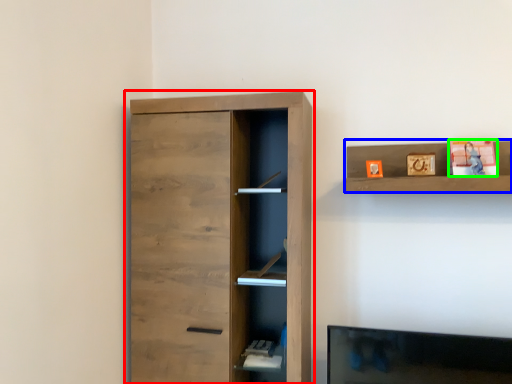
Question: Which object is the closest to the cupboard (highlighted by a red box)? Choose among these: shelf (highlighted by a blue box) or toy (highlighted by a green box).

Choices:
 (A) shelf
 (B) toy

Answer: (A)